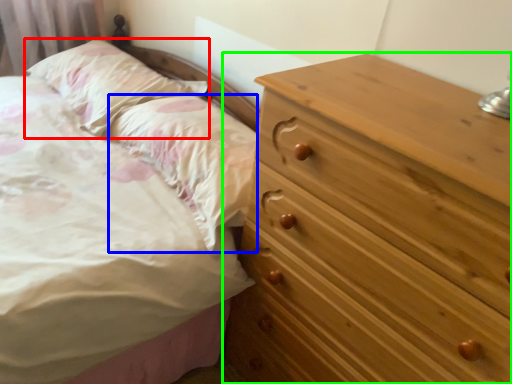
Question: Which is nearer to the pillow (highlighted by a red box)? pillow (highlighted by a blue box) or chest of drawers (highlighted by a green box).

Choices:
 (A) pillow
 (B) chest of drawers

Answer: (A)